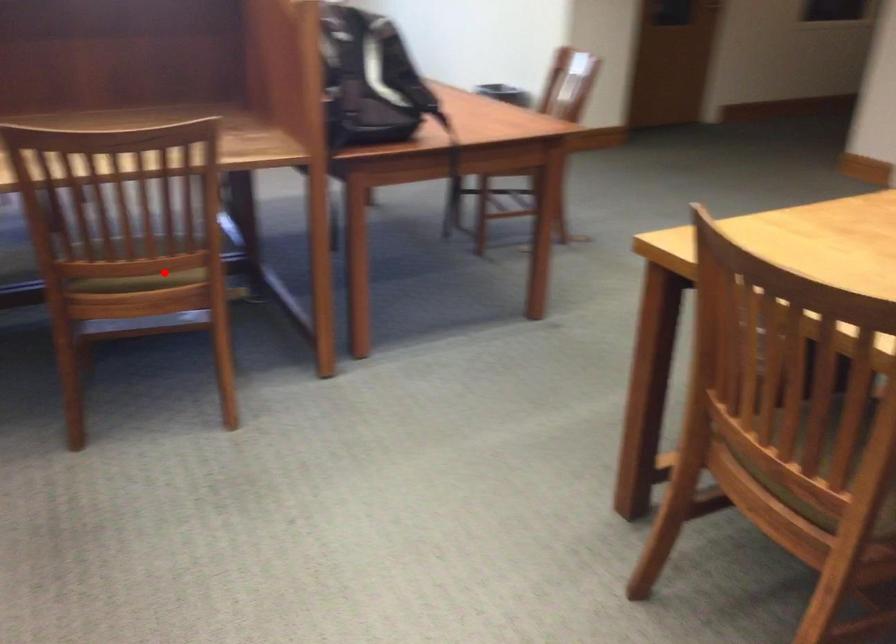
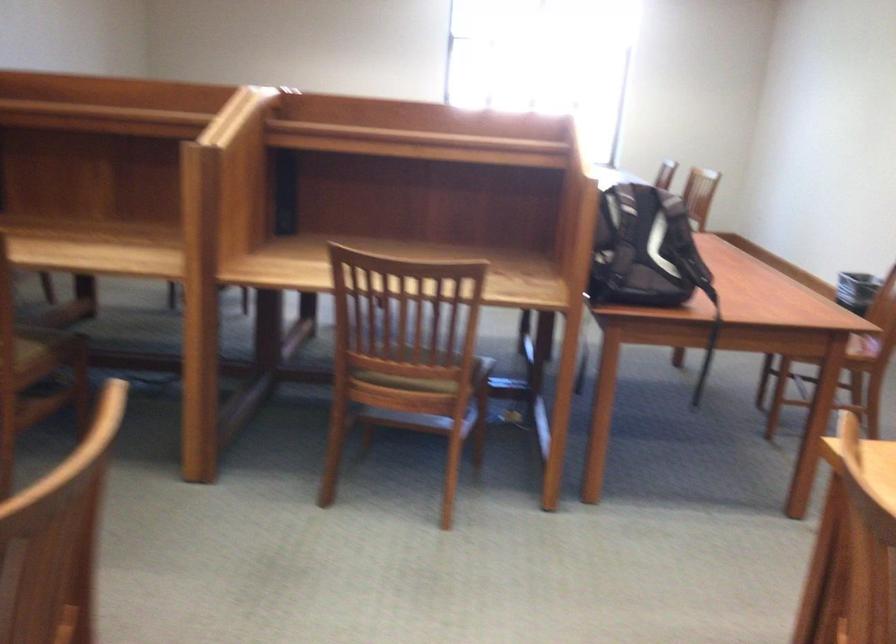
In the second image, find the point that corresponds to the highlighted location in the first image.

(421, 379)